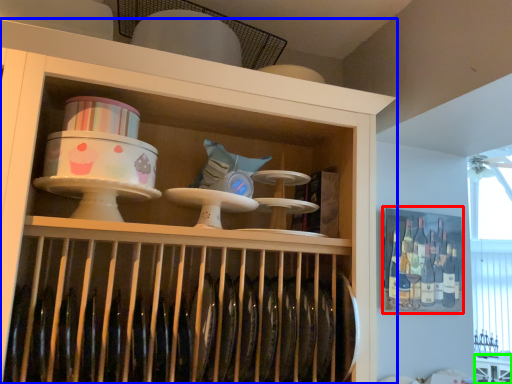
Question: Considering the real-world distances, which object is farthest from cabinet (highlighted by a red box)? shelf (highlighted by a blue box) or table (highlighted by a green box)?

Choices:
 (A) shelf
 (B) table

Answer: (A)